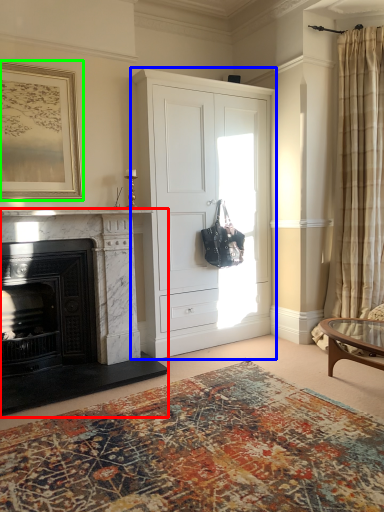
Question: Which object is the farthest from fireplace (highlighted by a red box)? Choose among these: cabinetry (highlighted by a blue box) or picture frame (highlighted by a green box).

Choices:
 (A) cabinetry
 (B) picture frame

Answer: (B)